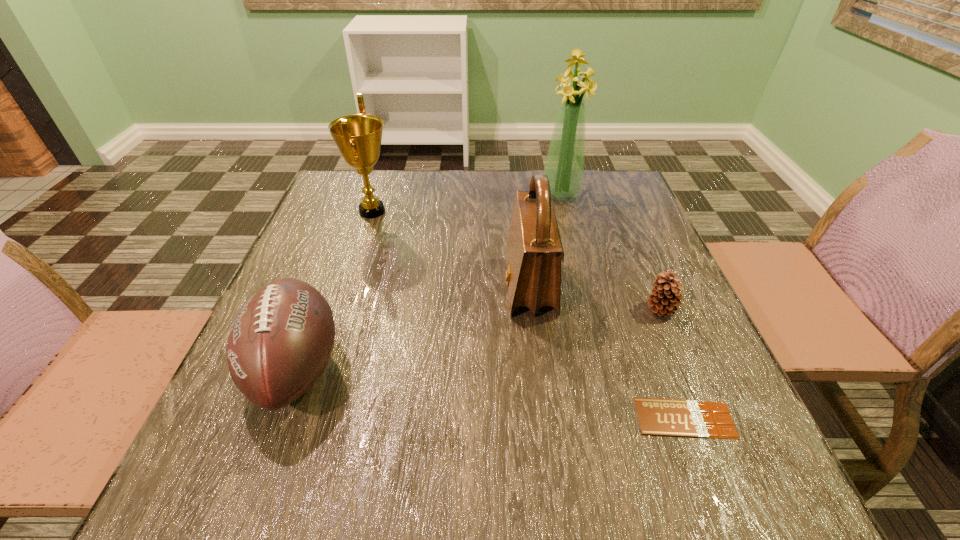
This screenshot has height=540, width=960. I want to click on chocolate bar present at the right edge, so click(662, 417).

At what (x,y) coordinates should I click in order to perform the action: click on object situated at the far left corner. Please return your answer as a coordinate pair (x, y). The height and width of the screenshot is (540, 960). Looking at the image, I should click on (358, 137).

The height and width of the screenshot is (540, 960). In order to click on object that is at the far right corner in this screenshot , I will do `click(564, 166)`.

Where is `vacant space at the far edge`? The height and width of the screenshot is (540, 960). vacant space at the far edge is located at coordinates pos(522,186).

Identify the location of vacant space at the near edge. (458, 489).

You are a GUI agent. You are given a task and a screenshot of the screen. Output one action in this format:
    pyautogui.click(x=<x>, y=<y>)
    Task: Click on the vacant space at the right edge of the desktop
    The image size is (960, 540).
    Given the screenshot: What is the action you would take?
    pyautogui.click(x=591, y=226)

Where is `vacant space at the far left corner`? Image resolution: width=960 pixels, height=540 pixels. vacant space at the far left corner is located at coordinates (339, 207).

In the image, there is a desktop. At what (x,y) coordinates should I click in order to perform the action: click on free space at the far right corner. Please return your answer as a coordinate pair (x, y). The width and height of the screenshot is (960, 540). Looking at the image, I should click on (616, 175).

Identify the location of free space between the football (American) and the second shortest object. This screenshot has height=540, width=960. click(x=479, y=339).

At what (x,y) coordinates should I click in order to perform the action: click on free space between the award and the third shortest object. Please return your answer as a coordinate pair (x, y). The width and height of the screenshot is (960, 540). Looking at the image, I should click on (335, 289).